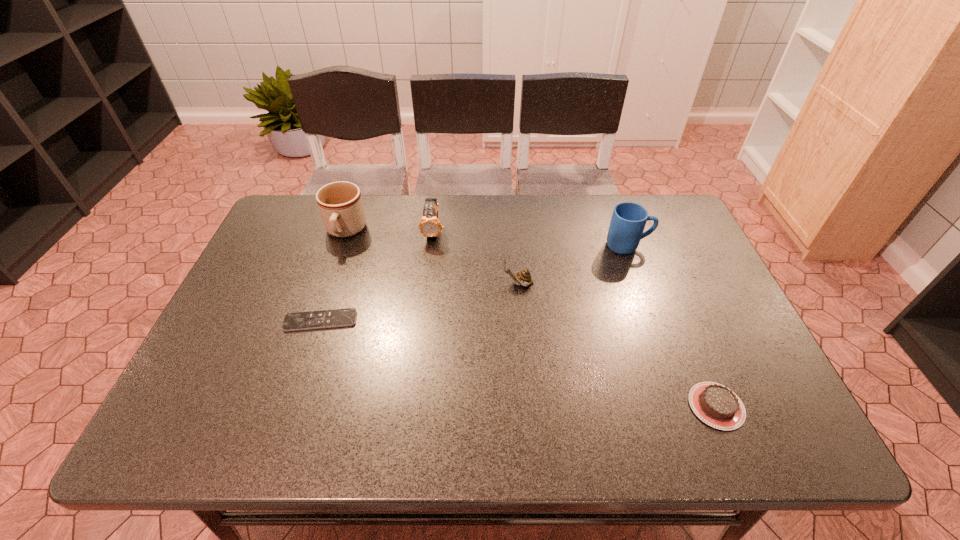
At what (x,y) coordinates should I click in order to perform the action: click on the left mug. Please return your answer as a coordinate pair (x, y). The image size is (960, 540). Looking at the image, I should click on (340, 204).

Find the location of a particular element. The width and height of the screenshot is (960, 540). the right mug is located at coordinates (628, 220).

Find the location of `watch`. watch is located at coordinates (429, 226).

Where is `the third shortest object`? The image size is (960, 540). the third shortest object is located at coordinates (523, 278).

Find the location of a particular element. This screenshot has width=960, height=540. the third object from right to left is located at coordinates (523, 278).

I want to click on the second shortest object, so click(716, 405).

Find the location of a particular element. The width and height of the screenshot is (960, 540). chocolate cake is located at coordinates (716, 405).

The height and width of the screenshot is (540, 960). I want to click on the second nearest object, so click(x=333, y=318).

Identify the location of remote control. The width and height of the screenshot is (960, 540). (333, 318).

Image resolution: width=960 pixels, height=540 pixels. What are the coordinates of `vacant area located 0.350m on the side of the left mug with the handle` in the screenshot? It's located at (306, 346).